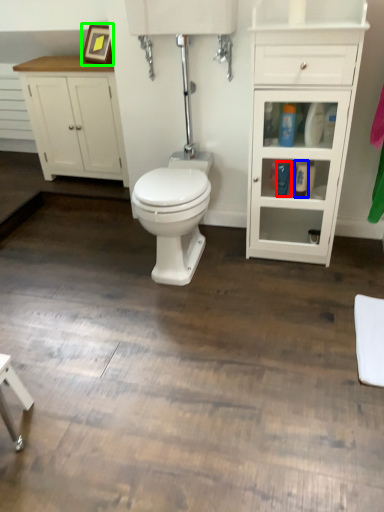
Question: Based on their relative distances, which object is farther from toiletry (highlighted by a red box)? Choose from toiletry (highlighted by a blue box) and picture frame (highlighted by a green box).

Choices:
 (A) toiletry
 (B) picture frame

Answer: (B)